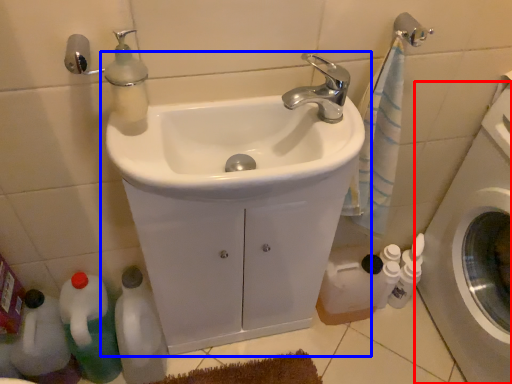
Question: Which of the following is the farthest to the observer, washing machine (highlighted by a red box) or sink (highlighted by a blue box)?

Choices:
 (A) washing machine
 (B) sink

Answer: (B)